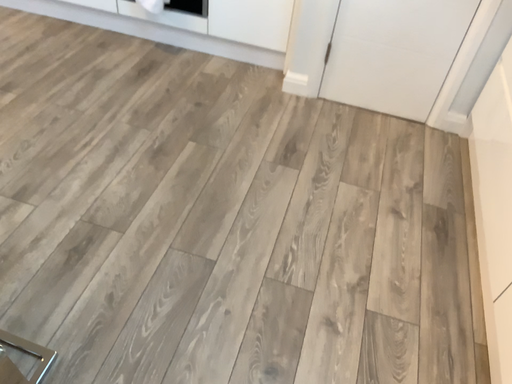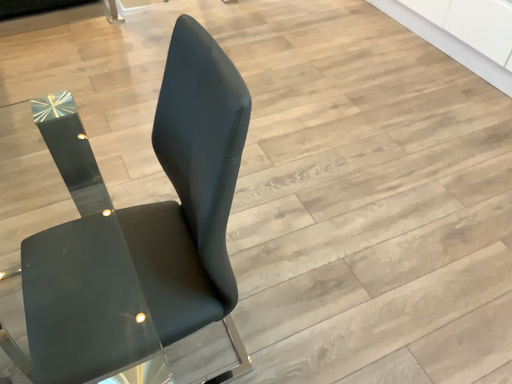
Question: Which way did the camera rotate in the video?

Choices:
 (A) rotated downward
 (B) rotated upward

Answer: (B)